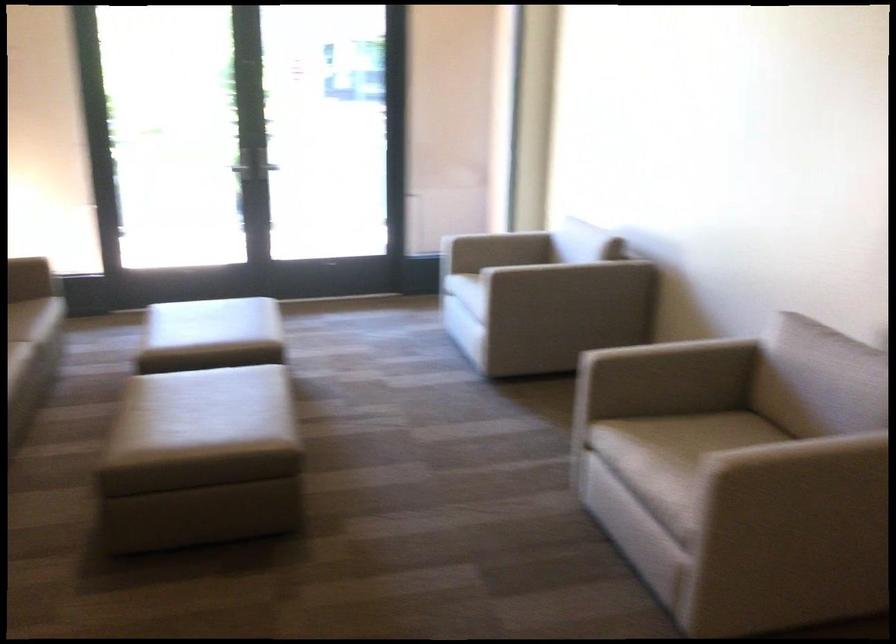
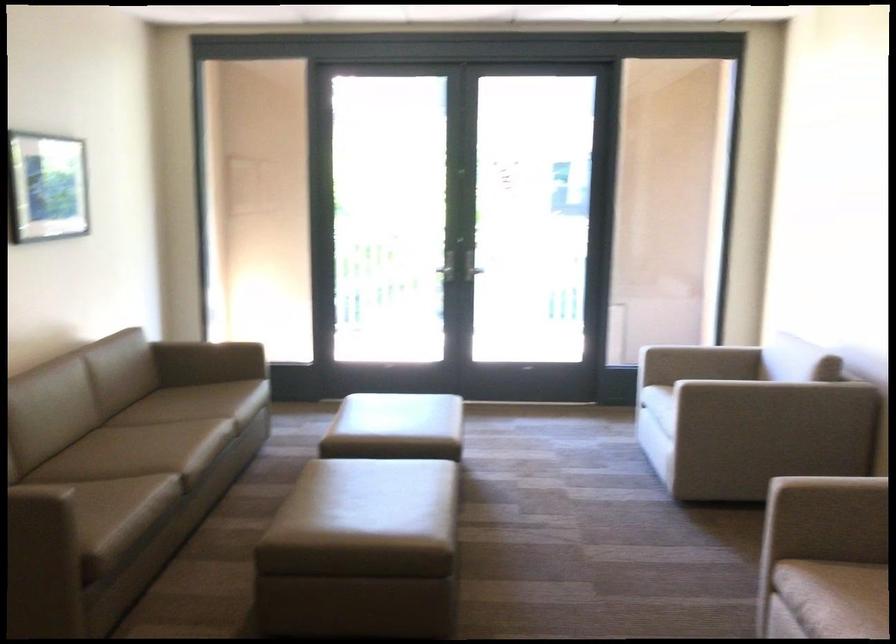
The point at (201, 430) is marked in the first image. Where is the corresponding point in the second image?

(367, 521)